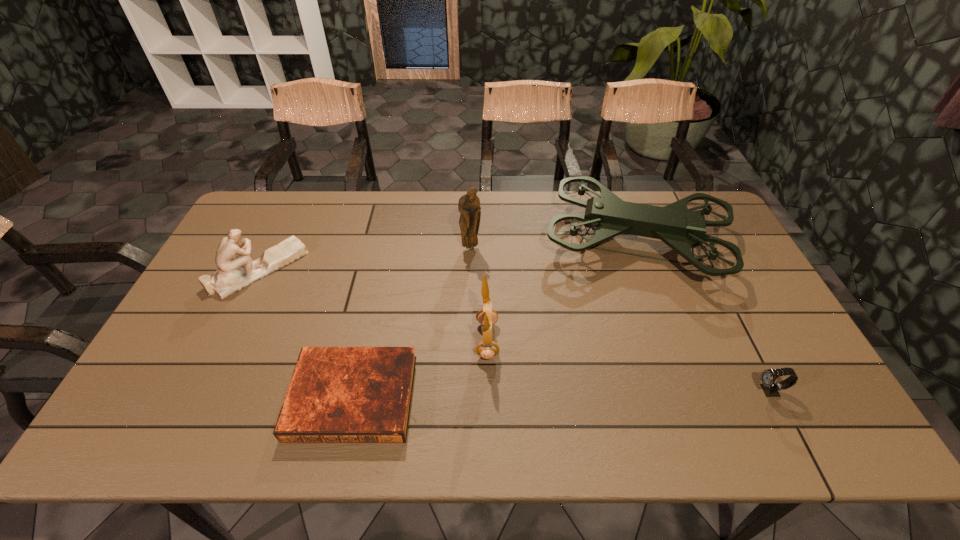
The height and width of the screenshot is (540, 960). In order to click on free space between the earphone and the Bible in this screenshot , I will do `click(420, 368)`.

Where is `vacant area that lies between the third shortest object and the fifth shortest object`? vacant area that lies between the third shortest object and the fifth shortest object is located at coordinates (365, 259).

At what (x,y) coordinates should I click in order to perform the action: click on vacant area that lies between the watch and the leftmost object. Please return your answer as a coordinate pair (x, y). The height and width of the screenshot is (540, 960). Looking at the image, I should click on (515, 330).

Where is `vacant space in between the drone and the earphone`? This screenshot has width=960, height=540. vacant space in between the drone and the earphone is located at coordinates (562, 291).

The width and height of the screenshot is (960, 540). Identify the location of empty space that is in between the tallest object and the earphone. (562, 291).

Find the location of a particular element. free point between the Bible and the second shortest object is located at coordinates (562, 394).

Locate which object ranks third in proximity to the earphone. Please provide its 2D coordinates. Your answer should be formatted as a tuple, i.e. [(x, y)], where the tuple contains the x and y coordinates of a point satisfying the conditions above.

[(469, 204)]

Locate an element on the screen. the closest object to the taller figurine is located at coordinates pos(607,215).

Locate an element on the screen. The image size is (960, 540). blank space that satisfies the following two spatial constraints: 1. on the front-facing side of the taller figurine; 2. on the front-facing side of the left figurine is located at coordinates (470, 269).

I want to click on vacant space that satisfies the following two spatial constraints: 1. on the face of the watch; 2. on the spine side of the Bible, so click(773, 397).